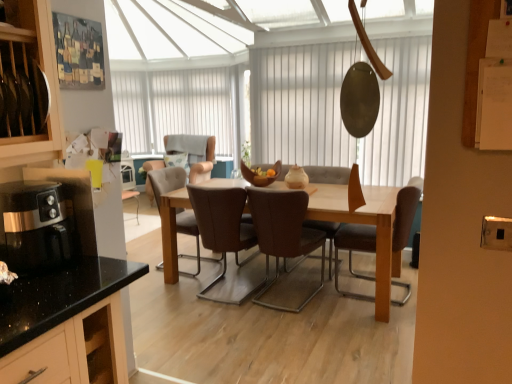
Question: Considering their positions, is brown leather chair at center, arranged as the 6th chair when viewed from the back, located in front of or behind brown leather chair at center, which is the 4th chair in back-to-front order?

Choices:
 (A) behind
 (B) front

Answer: (B)

Question: Considering the relative positions of brown leather chair at center, arranged as the 6th chair when viewed from the back, and brown leather chair at center, which is the 4th chair in back-to-front order, in the image provided, is brown leather chair at center, arranged as the 6th chair when viewed from the back, to the left or to the right of brown leather chair at center, which is the 4th chair in back-to-front order,?

Choices:
 (A) left
 (B) right

Answer: (B)

Question: Which is farther from the brown leather chair at center, arranged as the fifth chair when viewed from the front?

Choices:
 (A) black glossy coffee machine at left
 (B) brown leather chair at center, which is the 4th chair in back-to-front order
 (C) brown leather chair at center, acting as the 4th chair starting from the front
 (D) white vertical blinds at upper center, which is the 2th window screen from right to left
 (E) beige fabric chair at center, which is the first chair in back-to-front order

Answer: (D)

Question: Estimate the real-world distances between objects in this image. Which object is closer to the beige fabric chair at center, the sixth chair viewed from the front?

Choices:
 (A) brown leather chair at center, arranged as the 6th chair when viewed from the back
 (B) brown leather chair at center, which is the 2th chair from front to back
 (C) brown leather chair at center, which ranks as the second chair in back-to-front order
 (D) brown leather chair at center, marked as the third chair in a back-to-front arrangement
 (E) black glossy coffee machine at left

Answer: (C)